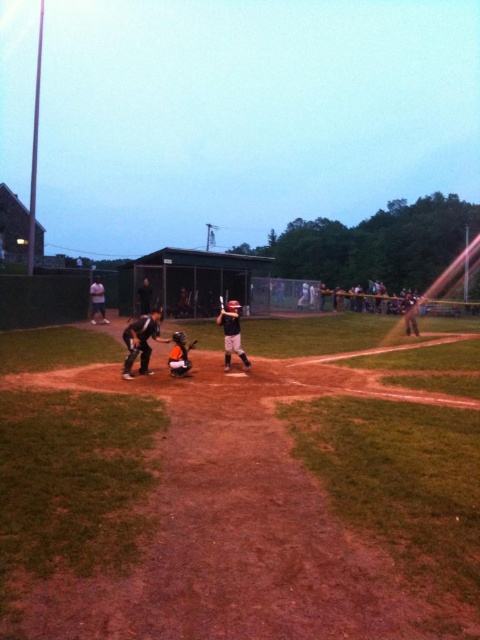
Is matte black catcher at center wider than brown leather glove at center?

Yes, matte black catcher at center is wider than brown leather glove at center.

Can you confirm if matte black catcher at center is positioned to the right of brown leather glove at center?

No, matte black catcher at center is not to the right of brown leather glove at center.

Between point (137, 324) and point (192, 340), which one is positioned in front?

Point (137, 324) is more forward.

The height and width of the screenshot is (640, 480). In order to click on matte black catcher at center in this screenshot , I will do `click(141, 340)`.

Which of these two, light blue shirt at center or black matte baseball bat at center, stands taller?

Standing taller between the two is light blue shirt at center.

Does light blue shirt at center have a lesser width compared to black matte baseball bat at center?

Yes.

Where is `light blue shirt at center`? The image size is (480, 640). light blue shirt at center is located at coordinates (96, 300).

Is orange jersey at center closer to the viewer compared to brown leather glove at center?

No, orange jersey at center is further to the viewer.

Who is higher up, orange jersey at center or brown leather glove at center?

orange jersey at center

Where is `orange jersey at center`? The width and height of the screenshot is (480, 640). orange jersey at center is located at coordinates (409, 314).